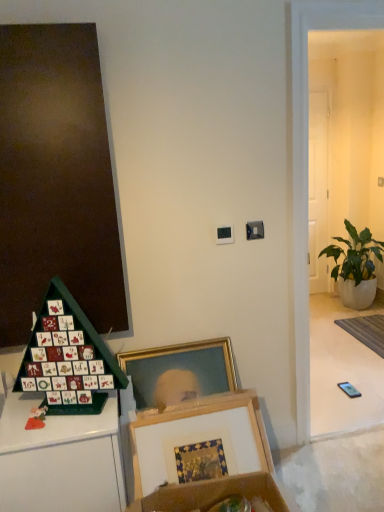
Question: Is gray woven mat at lower right not near green leafy plant in white pot at right?

Choices:
 (A) no
 (B) yes

Answer: (A)

Question: Is green leafy plant in white pot at right a part of gray woven mat at lower right?

Choices:
 (A) yes
 (B) no

Answer: (B)

Question: Is gray woven mat at lower right outside green leafy plant in white pot at right?

Choices:
 (A) yes
 (B) no

Answer: (A)

Question: Considering the relative sizes of gray woven mat at lower right and green leafy plant in white pot at right in the image provided, is gray woven mat at lower right smaller than green leafy plant in white pot at right?

Choices:
 (A) yes
 (B) no

Answer: (A)

Question: Is gray woven mat at lower right positioned behind green leafy plant in white pot at right?

Choices:
 (A) no
 (B) yes

Answer: (A)

Question: In terms of width, does white glossy door at right look wider or thinner when compared to green leafy plant in white pot at right?

Choices:
 (A) thin
 (B) wide

Answer: (A)

Question: Visually, is white glossy door at right positioned to the left or to the right of green leafy plant in white pot at right?

Choices:
 (A) left
 (B) right

Answer: (A)

Question: In terms of size, does white glossy door at right appear bigger or smaller than green leafy plant in white pot at right?

Choices:
 (A) big
 (B) small

Answer: (B)

Question: From a real-world perspective, is white glossy door at right positioned above or below green leafy plant in white pot at right?

Choices:
 (A) below
 (B) above

Answer: (B)

Question: Is wooden picture frame at lower center wider or thinner than green cardboard advent calendar at lower left?

Choices:
 (A) wide
 (B) thin

Answer: (B)

Question: Considering their positions, is wooden picture frame at lower center located in front of or behind green cardboard advent calendar at lower left?

Choices:
 (A) front
 (B) behind

Answer: (B)

Question: In terms of height, does wooden picture frame at lower center look taller or shorter compared to green cardboard advent calendar at lower left?

Choices:
 (A) tall
 (B) short

Answer: (A)

Question: From the image's perspective, is wooden picture frame at lower center positioned above or below green cardboard advent calendar at lower left?

Choices:
 (A) above
 (B) below

Answer: (B)

Question: From a real-world perspective, is green leafy plant in white pot at right above or below gray woven mat at lower right?

Choices:
 (A) above
 (B) below

Answer: (A)

Question: From the image's perspective, is green leafy plant in white pot at right above or below gray woven mat at lower right?

Choices:
 (A) below
 (B) above

Answer: (B)